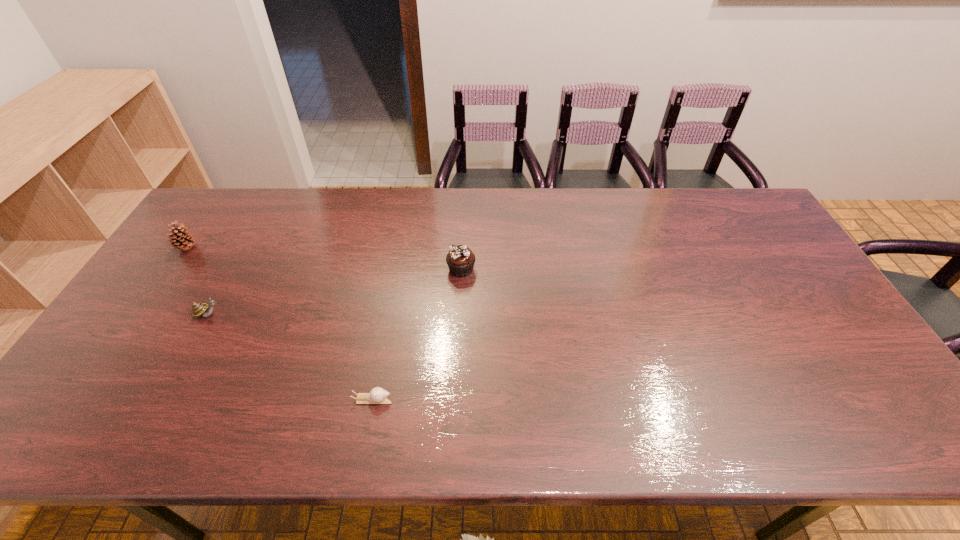
You are a GUI agent. You are given a task and a screenshot of the screen. Output one action in this format:
    pyautogui.click(x=<x>, y=<y>)
    Task: Click on the object that can be found as the second closest to the right escargot
    
    Given the screenshot: What is the action you would take?
    pyautogui.click(x=198, y=309)

Locate an element on the screen. the second closest object to the second farthest object is located at coordinates (198, 309).

Find the location of `vacant space that satisfies the following two spatial constraints: 1. on the front side of the rightmost object; 2. on the right side of the leftmost object`. vacant space that satisfies the following two spatial constraints: 1. on the front side of the rightmost object; 2. on the right side of the leftmost object is located at coordinates (172, 269).

Locate an element on the screen. This screenshot has width=960, height=540. vacant area that satisfies the following two spatial constraints: 1. on the front side of the cupcake; 2. on the left side of the farthest object is located at coordinates (172, 269).